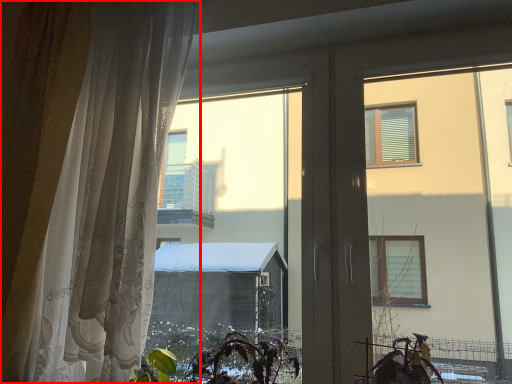
Question: From the image's perspective, considering the relative positions of curtain (annotated by the red box) and vegetation in the image provided, where is curtain (annotated by the red box) located with respect to the staircase?

Choices:
 (A) above
 (B) below

Answer: (A)